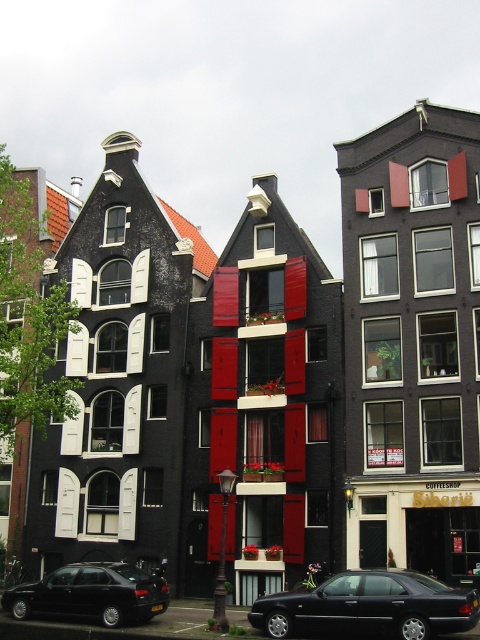
You are driving a car and want to park in the parking lot behind the Dutch buildings. There are two shiny black sedans in the scene. Which one, the shiny black sedan at center or the shiny black sedan at lower left, is blocking your path to the parking lot?

The shiny black sedan at center is blocking your path to the parking lot because it is in front of the shiny black sedan at lower left, meaning it is closer to you and obstructing access to the parking area behind.

You are standing in front of the row of Dutch buildings. There are two points marked on the buildings. One is at coordinate point (x=388, y=616) and the other is at point (x=63, y=570). Which point is closer to you?

Point (x=388, y=616) is closer to the viewer than point (x=63, y=570).